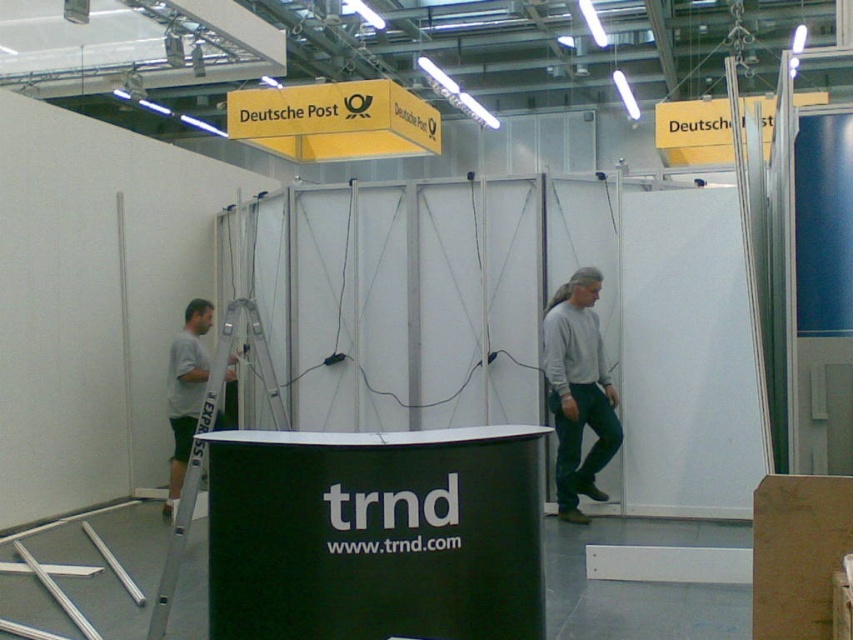
Question: Does gray sweater at center come behind yellow paper sign at upper center?

Choices:
 (A) no
 (B) yes

Answer: (A)

Question: Which of the following is the farthest from the observer?

Choices:
 (A) (347, 125)
 (B) (592, 285)

Answer: (A)

Question: Does yellow matte sign at upper center appear under gray sweater at center?

Choices:
 (A) yes
 (B) no

Answer: (B)

Question: Which object is positioned closest to the yellow matte sign at upper center?

Choices:
 (A) gray cotton t-shirt at left
 (B) gray sweater at center

Answer: (A)

Question: Can you confirm if gray sweater at center is wider than yellow paper sign at upper center?

Choices:
 (A) no
 (B) yes

Answer: (A)

Question: Which point is farther from the camera taking this photo?

Choices:
 (A) (564, 353)
 (B) (381, 108)

Answer: (B)